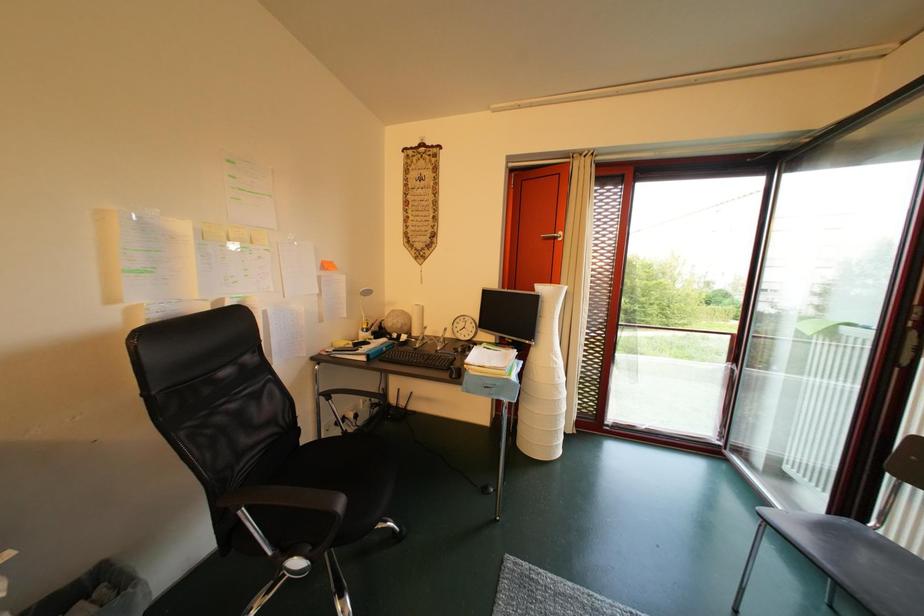
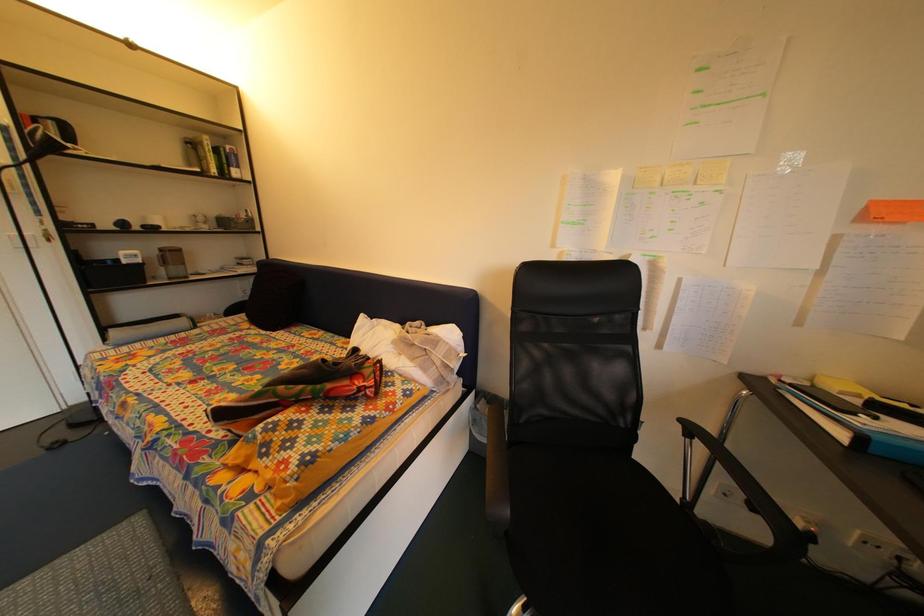
The first image is from the beginning of the video and the second image is from the end. How did the camera likely rotate when shooting the video?

The camera rotated toward left-down.